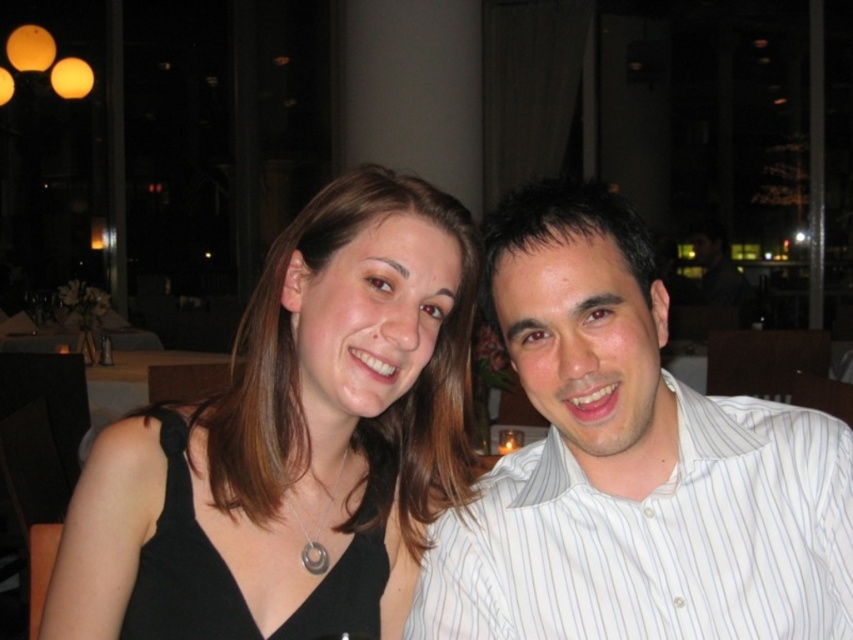
Where is `white striped shirt at center`? white striped shirt at center is located at coordinates (631, 465).

Between point (671, 448) and point (264, 602), which one is positioned in front?

Point (671, 448) is more forward.

Who is more forward, (x=546, y=490) or (x=107, y=492)?

Point (x=107, y=492)

Where is `white striped shirt at center`? white striped shirt at center is located at coordinates (631, 465).